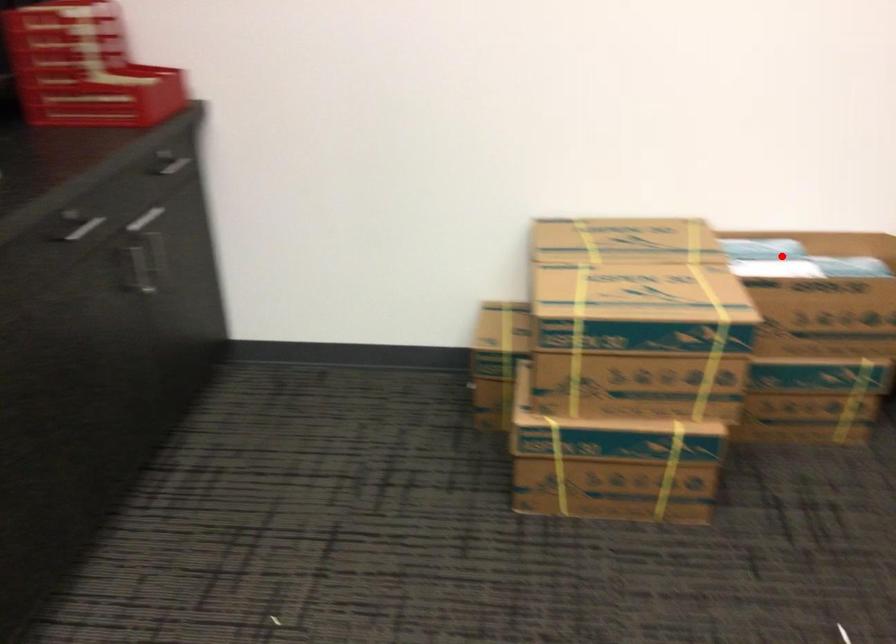
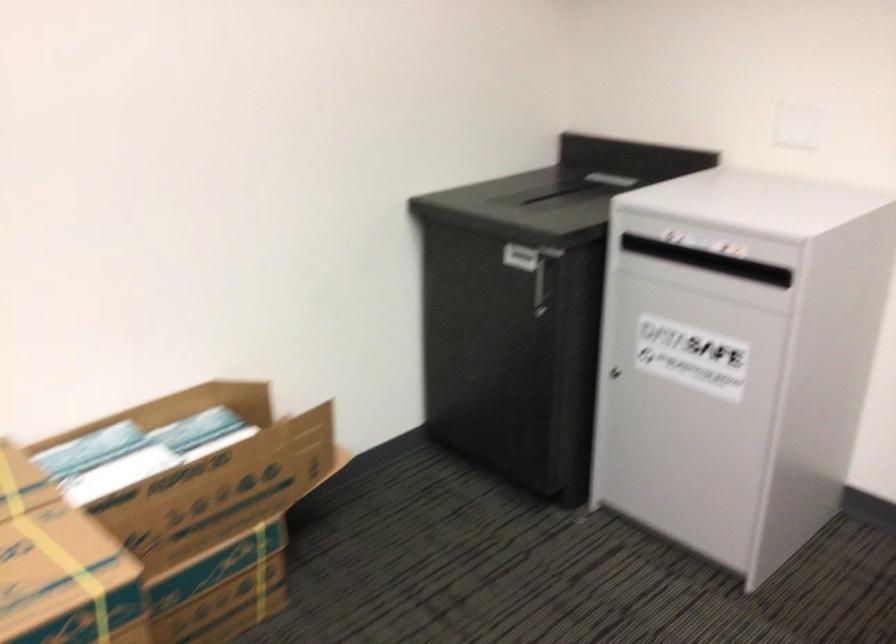
Question: I am providing you with two images of the same scene from different viewpoints. Given a red point in image1, look at the same physical point in image2. Is it:

Choices:
 (A) Closer to the viewpoint
 (B) Farther from the viewpoint

Answer: (A)